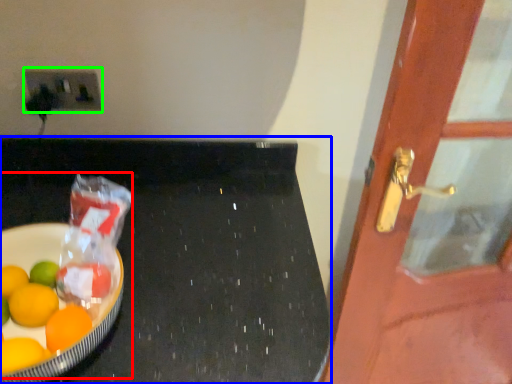
Question: Which object is the farthest from fruit dish (highlighted by a red box)? Choose among these: table (highlighted by a blue box) or electric outlet (highlighted by a green box).

Choices:
 (A) table
 (B) electric outlet

Answer: (B)